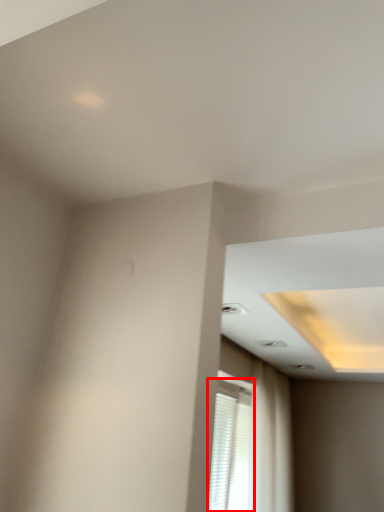
Question: From the image's perspective, considering the relative positions of window (annotated by the red box) and curtain in the image provided, where is window (annotated by the red box) located with respect to the staircase?

Choices:
 (A) below
 (B) above

Answer: (B)